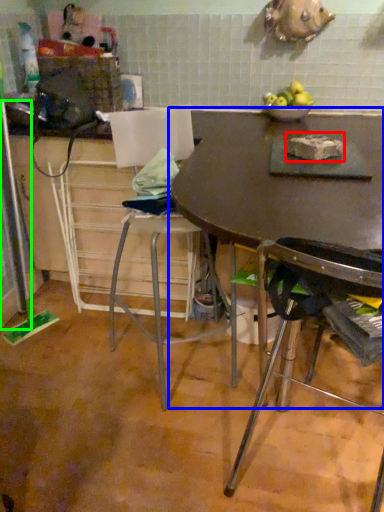
Question: Considering the real-world distances, which object is farthest from food (highlighted by a red box)? table (highlighted by a blue box) or screen door (highlighted by a green box)?

Choices:
 (A) table
 (B) screen door

Answer: (B)